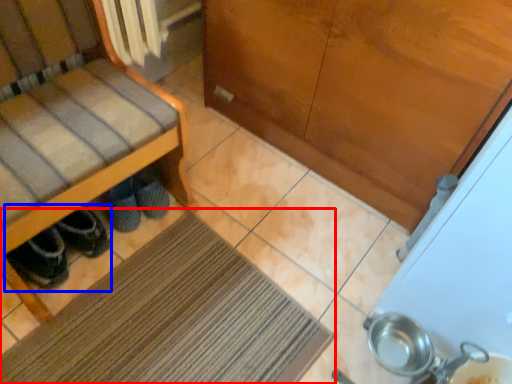
Question: Which of the following is the farthest to the observer, mat (highlighted by a red box) or footwear (highlighted by a blue box)?

Choices:
 (A) mat
 (B) footwear

Answer: (B)